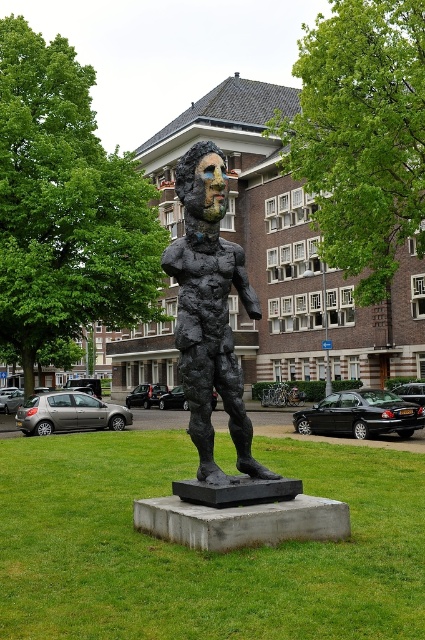
Consider the image. Is black stone statue at center positioned at the back of bronze textured figure at center?

No, it is in front of bronze textured figure at center.

This screenshot has width=425, height=640. What do you see at coordinates (198, 552) in the screenshot?
I see `black stone statue at center` at bounding box center [198, 552].

Locate an element on the screen. black stone statue at center is located at coordinates (198, 552).